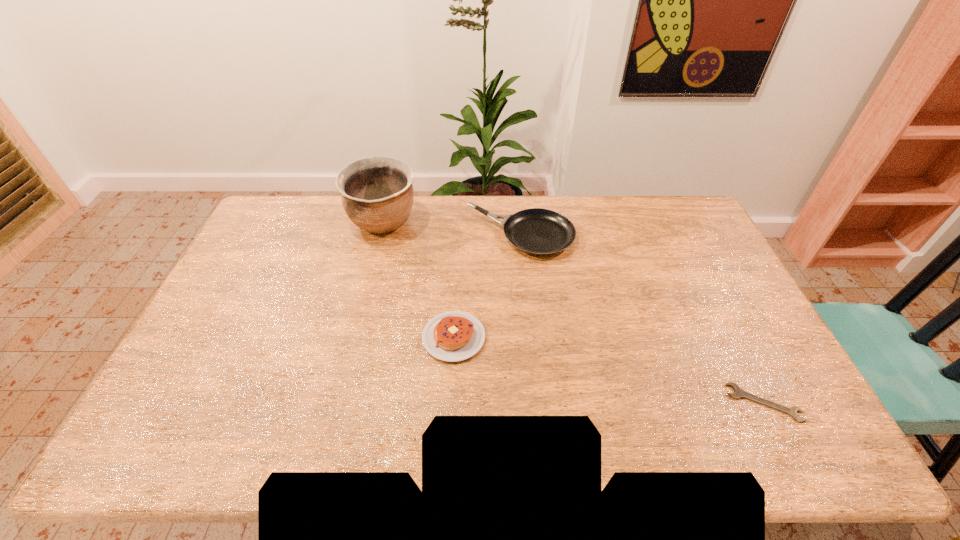
The height and width of the screenshot is (540, 960). Find the location of `free spot between the third tallest object and the shortest object`. free spot between the third tallest object and the shortest object is located at coordinates (609, 370).

Where is `unoccupied position between the third shortest object and the leftmost object`? unoccupied position between the third shortest object and the leftmost object is located at coordinates (452, 230).

Where is `free spot between the pottery and the second nearest object`? free spot between the pottery and the second nearest object is located at coordinates (419, 280).

I want to click on free space between the shortest object and the leftmost object, so click(573, 313).

Identify the location of vacant point located between the nearest object and the pottery. (573, 313).

Locate an element on the screen. Image resolution: width=960 pixels, height=540 pixels. empty space between the pan and the tallest object is located at coordinates (452, 230).

Locate an element on the screen. unoccupied area between the tallest object and the rightmost object is located at coordinates (573, 313).

At what (x,y) coordinates should I click in order to perform the action: click on free space between the nearest object and the pottery. Please return your answer as a coordinate pair (x, y). This screenshot has height=540, width=960. Looking at the image, I should click on (573, 313).

In order to click on vacant area between the pancake and the pan in this screenshot , I will do click(x=487, y=287).

I want to click on free point between the pancake and the third shortest object, so click(x=487, y=287).